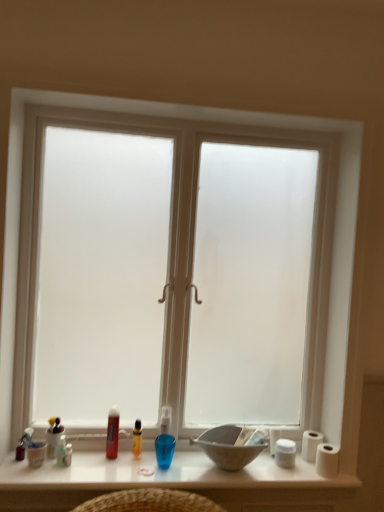
The height and width of the screenshot is (512, 384). Identify the location of free space in front of matte white cup at lower left, placed as the 2th toiletry when sorted from left to right. (48, 474).